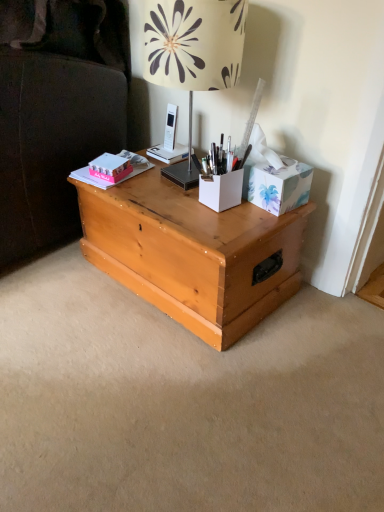
Locate an element on the screen. free space to the left of white matte pen holder at center, the first cardboard box in the left-to-right sequence is located at coordinates (168, 198).